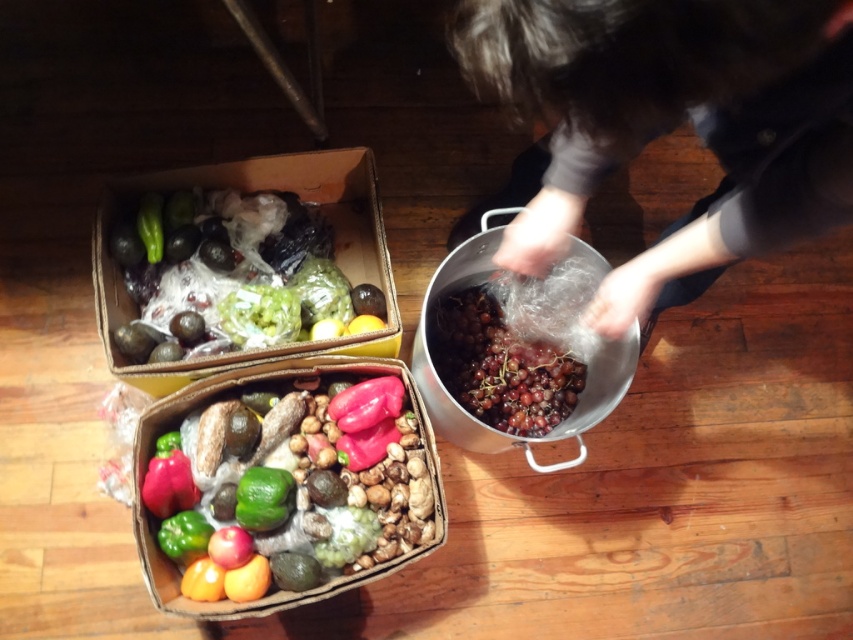
You are organizing the produce and need to place the shiny plastic peppers at center and the matte red pepper at lower left into a refrigerator shelf. The shelf has limited vertical space. Which of the two items will require more vertical space due to its height?

The shiny plastic peppers at center will require more vertical space because it is taller than the matte red pepper at lower left.

You are organizing the produce and need to retrieve the green matte pepper at lower left. Is it directly under the matte red pepper at lower left?

Yes, the matte red pepper at lower left is positioned over the green matte pepper at lower left, so the green matte pepper at lower left is directly underneath it.